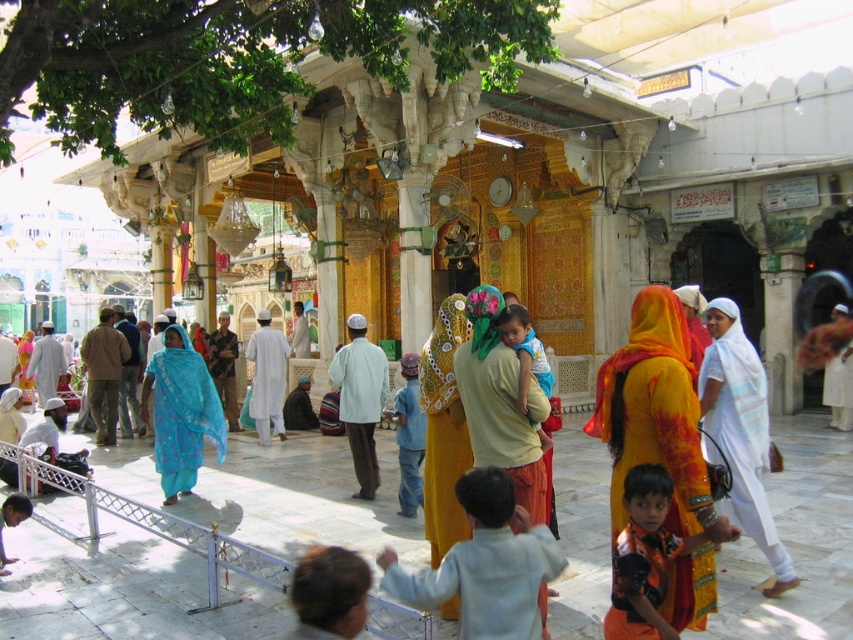
You are an anthropologist visiting this religious site and notice two garments at the center of the scene. The blue printed fabric at center and the white cotton robe at center. Which garment is smaller in size?

The blue printed fabric at center has a smaller size compared to the white cotton robe at center, so the blue printed fabric at center is the smaller garment.

Looking at this image, you are standing at the entrance of the mosque and see a point marked at coordinates point (485, 580). Which object is this point located on?

The point (485, 580) is located on the light blue cotton robe at lower center.